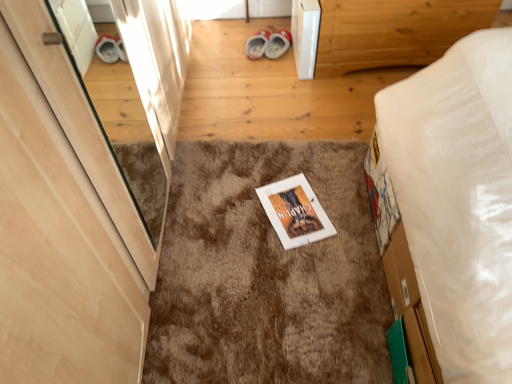
Locate an element on the screen. The width and height of the screenshot is (512, 384). free spot behind brown shaggy carpet at center is located at coordinates (264, 97).